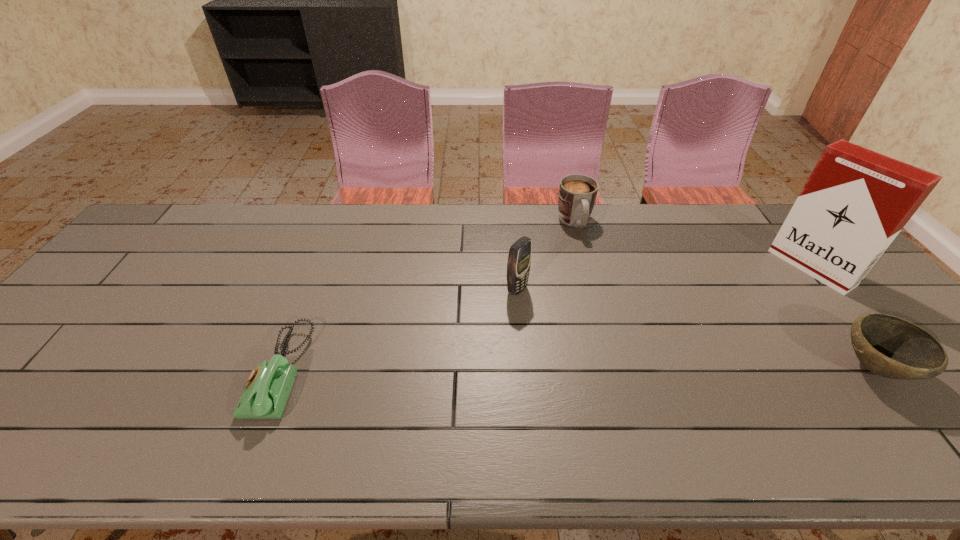
Locate an element on the screen. vacant space on the desktop that is between the telephone and the fourth tallest object and is positioned on the side of the third tallest object with the handle is located at coordinates (634, 369).

Where is `vacant space on the desktop that is between the leftmost object and the second shortest object and is positioned on the front face of the fourth shortest object`? vacant space on the desktop that is between the leftmost object and the second shortest object and is positioned on the front face of the fourth shortest object is located at coordinates (659, 369).

The image size is (960, 540). I want to click on vacant spot on the desktop that is between the leftmost object and the bowl and is positioned on the front-facing side of the cigarette_case, so click(647, 369).